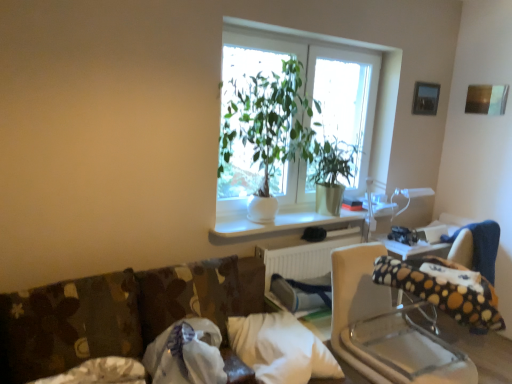
Question: From a real-world perspective, is white matte window sill at center above or below green glossy plant at center?

Choices:
 (A) below
 (B) above

Answer: (A)

Question: Is white matte window sill at center inside or outside of green glossy plant at center?

Choices:
 (A) outside
 (B) inside

Answer: (A)

Question: Which of these objects is positioned closest to the green matte plant at center?

Choices:
 (A) polka dot fabric bean bag chair at right
 (B) white fabric pillow at lower left, the second pillow when ordered from right to left
 (C) green glossy plant at center
 (D) polka dot fabric rocking chair at center
 (E) white matte window sill at center

Answer: (C)

Question: Which is nearer to the polka dot fabric bean bag chair at right?

Choices:
 (A) white matte radiator at center
 (B) polka dot fabric rocking chair at center
 (C) white matte window sill at center
 (D) white fabric pillow at lower left, which is the 2th pillow in left-to-right order
 (E) green glossy plant at center

Answer: (B)